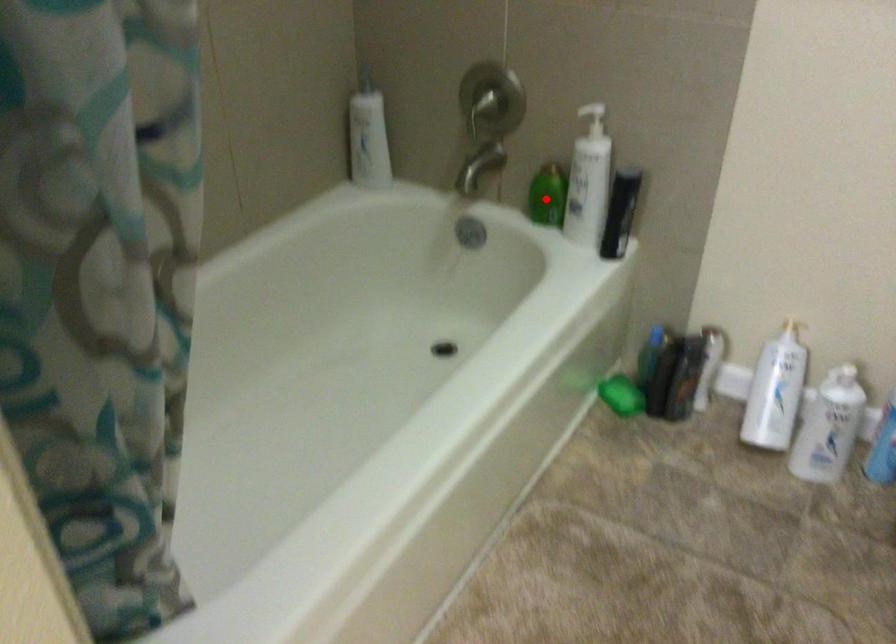
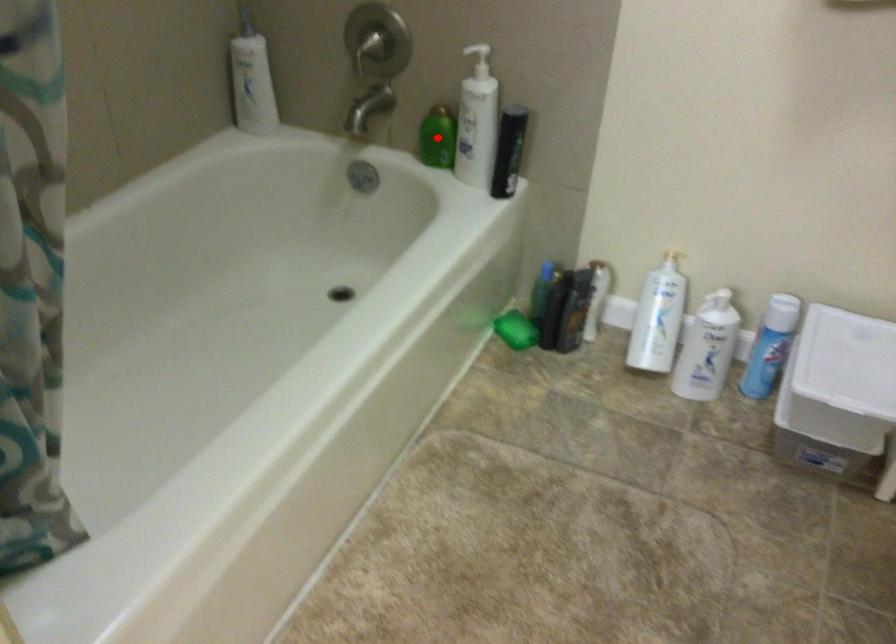
I am providing you with two images of the same scene from different viewpoints. A red point is marked on the first image and another point is marked on the second image. Is the marked point in image1 the same physical position as the marked point in image2?

Yes